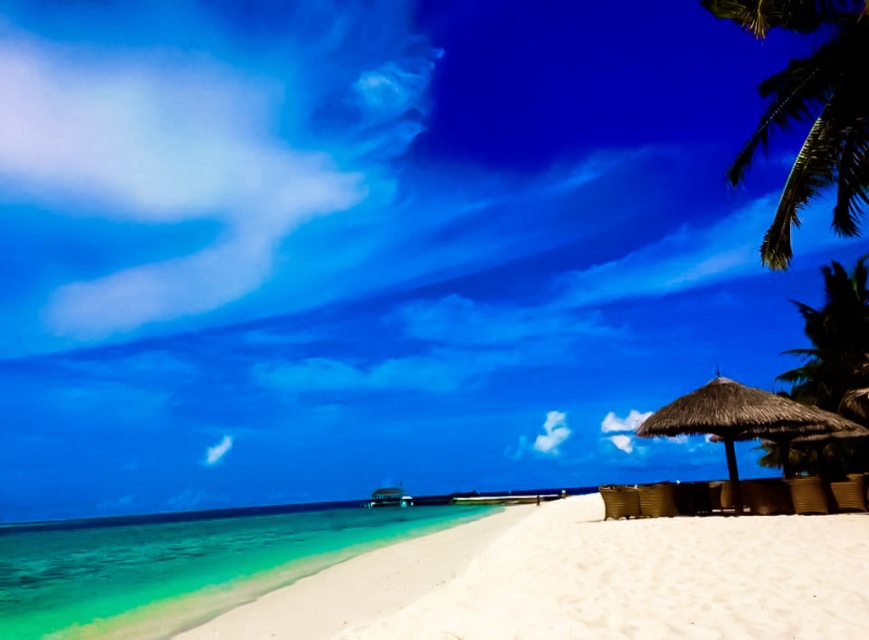
You are standing on the beach and want to take a photo of both the green leafy palm tree at upper right and the green leafy palm tree at right. Which palm tree is positioned higher in the frame?

The green leafy palm tree at upper right is located above the green leafy palm tree at right, so it is positioned higher in the frame.

You are a swimmer planning to dive into the clear water at lower left and the thatched straw umbrella at lower right. Which object is taller from your perspective?

The clear water at lower left is taller than the thatched straw umbrella at lower right, so the clear water at lower left is taller from your perspective.